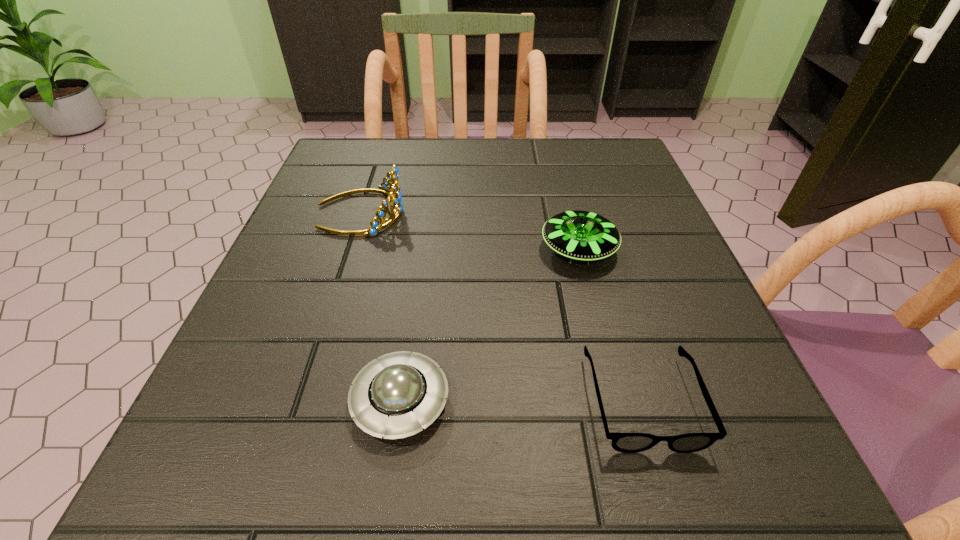
Locate an element on the screen. vacant region between the tiara and the shortest object is located at coordinates (501, 306).

Where is `unoccupied position between the tallest object and the shorter saucer`? unoccupied position between the tallest object and the shorter saucer is located at coordinates [x=380, y=306].

Where is `free space between the spectacles and the shorter saucer`? The image size is (960, 540). free space between the spectacles and the shorter saucer is located at coordinates (521, 401).

Choose which object is the nearest neighbor to the tallest object. Please provide its 2D coordinates. Your answer should be formatted as a tuple, i.e. [(x, y)], where the tuple contains the x and y coordinates of a point satisfying the conditions above.

[(580, 235)]

Find the location of a particular element. This screenshot has height=540, width=960. object that is the closest to the taller saucer is located at coordinates (623, 442).

Find the location of a particular element. vacant space that satisfies the following two spatial constraints: 1. on the back side of the third shortest object; 2. on the front-facing side of the tallest object is located at coordinates (569, 212).

This screenshot has height=540, width=960. I want to click on vacant space that satisfies the following two spatial constraints: 1. on the back side of the taller saucer; 2. on the front-facing side of the tiara, so click(x=569, y=212).

What are the coordinates of `free space that satisfies the following two spatial constraints: 1. on the back side of the right saucer; 2. on the right side of the nearer saucer` in the screenshot? It's located at (422, 249).

Where is `free space that satisfies the following two spatial constraints: 1. on the front-facing side of the tallest object; 2. on the right side of the taller saucer`? free space that satisfies the following two spatial constraints: 1. on the front-facing side of the tallest object; 2. on the right side of the taller saucer is located at coordinates (348, 249).